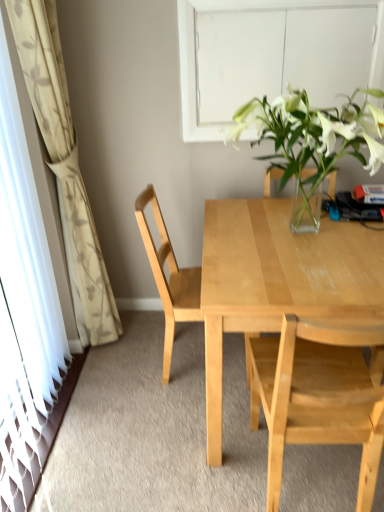
Where is `vacant space that is in between white floral-patterned curtain at left and light wood chair at center, marked as the first chair in a back-to-front arrangement`? The image size is (384, 512). vacant space that is in between white floral-patterned curtain at left and light wood chair at center, marked as the first chair in a back-to-front arrangement is located at coordinates (147, 348).